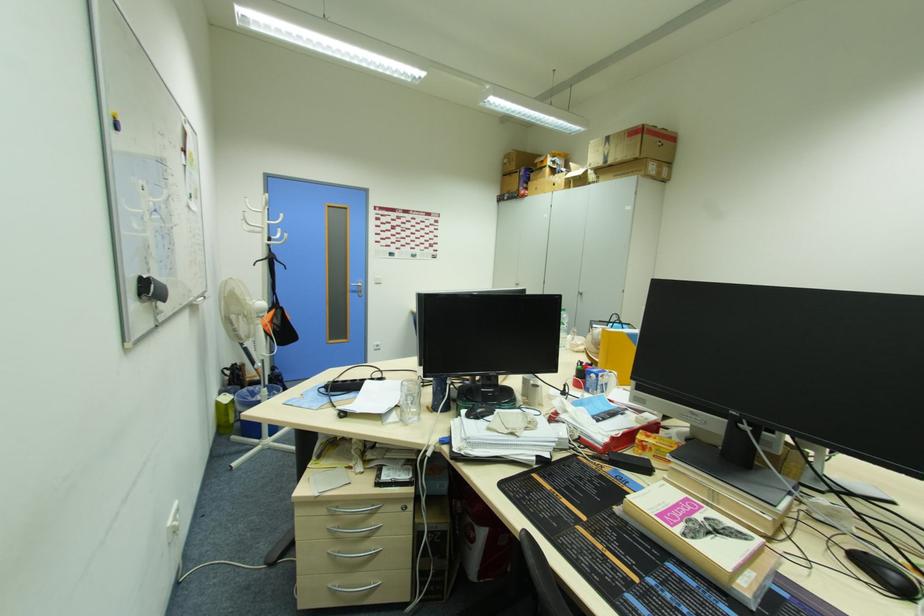
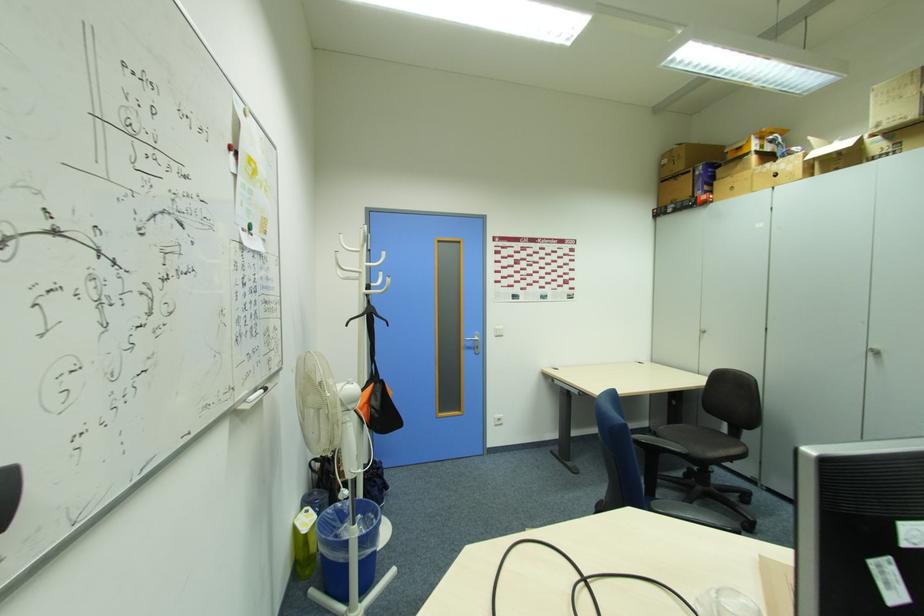
Find the pixel in the second image that matches point 506,177 in the first image.

(665, 182)